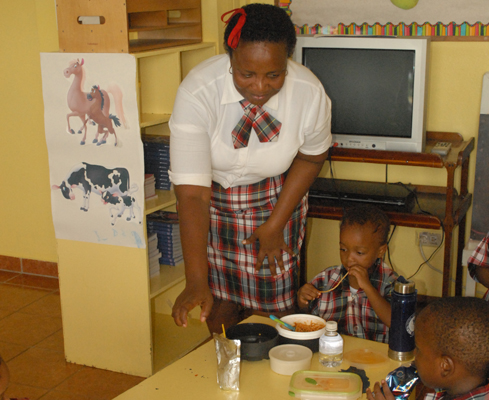
This screenshot has height=400, width=489. I want to click on food on table, so click(193, 388), click(197, 370).